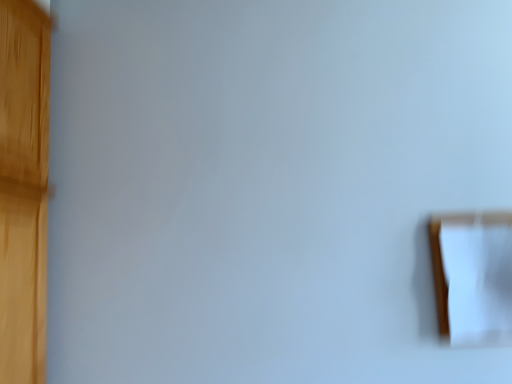
The height and width of the screenshot is (384, 512). What are the coordinates of `white fabric at right` in the screenshot? It's located at (473, 276).

This screenshot has width=512, height=384. Describe the element at coordinates (473, 276) in the screenshot. I see `white fabric at right` at that location.

At what (x,y) coordinates should I click in order to perform the action: click on white fabric at right. Please return your answer as a coordinate pair (x, y). Looking at the image, I should click on (473, 276).